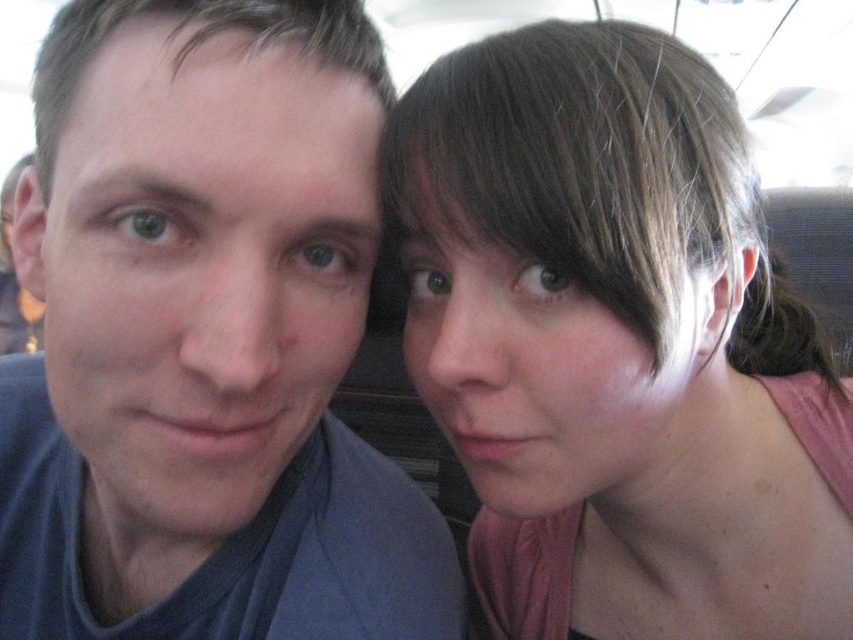
Question: Which object is farther from the camera taking this photo?

Choices:
 (A) blue matte shirt at left
 (B) pink fabric at upper right

Answer: (B)

Question: Does blue matte shirt at left have a larger size compared to pink fabric at upper right?

Choices:
 (A) yes
 (B) no

Answer: (B)

Question: Is blue matte shirt at left wider than pink fabric at upper right?

Choices:
 (A) no
 (B) yes

Answer: (A)

Question: Can you confirm if blue matte shirt at left is thinner than pink fabric at upper right?

Choices:
 (A) no
 (B) yes

Answer: (B)